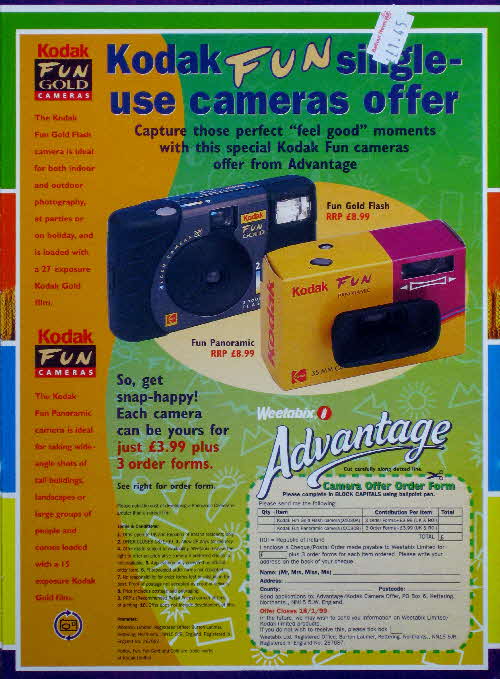
Identify the location of sticker. The width and height of the screenshot is (500, 679). (388, 34).